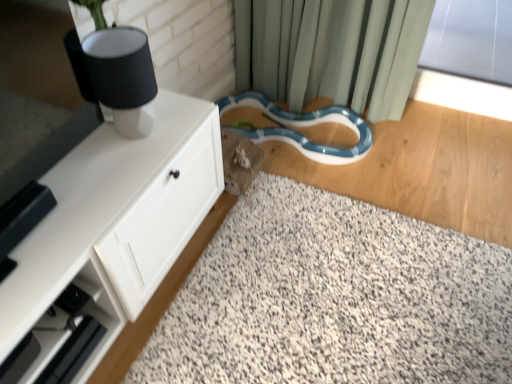
Locate an element on the screen. This screenshot has width=512, height=384. vacant point to the right of blue glossy snake at lower center is located at coordinates (419, 156).